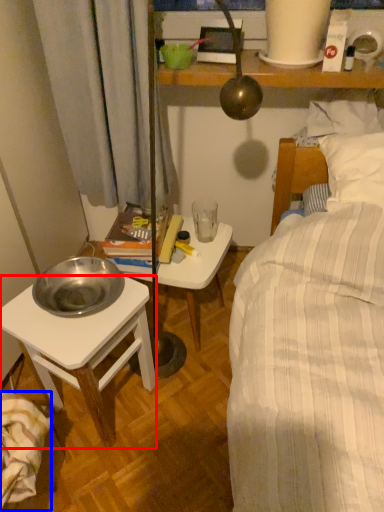
Question: Among these objects, which one is nearest to the camera, desk (highlighted by a red box) or blanket (highlighted by a blue box)?

Choices:
 (A) desk
 (B) blanket

Answer: (B)